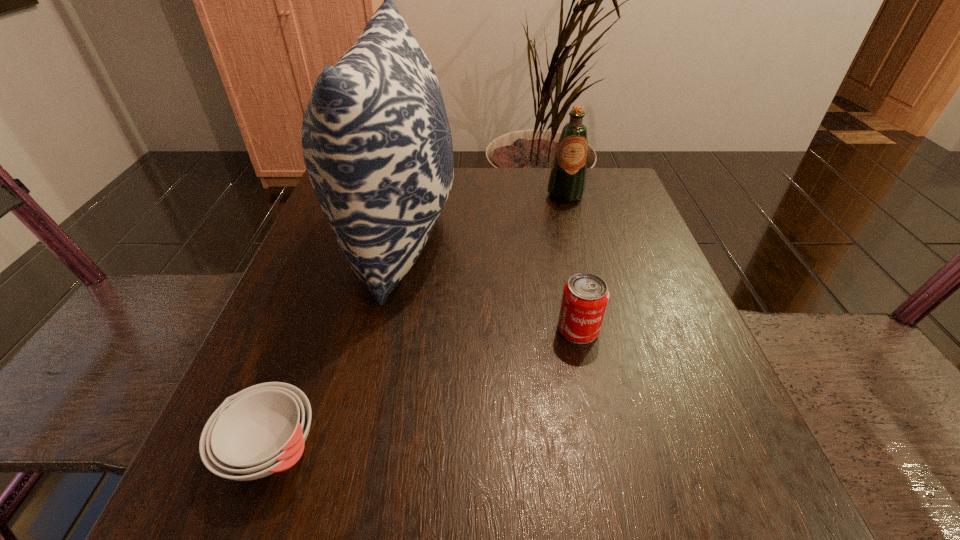
Where is `cushion`? The width and height of the screenshot is (960, 540). cushion is located at coordinates (376, 140).

In order to click on olive oil in this screenshot , I will do `click(567, 181)`.

The height and width of the screenshot is (540, 960). Find the location of `the second shortest object`. the second shortest object is located at coordinates (585, 296).

I want to click on soup bowl, so click(260, 430).

The image size is (960, 540). What are the coordinates of `the nearest object` in the screenshot? It's located at (260, 430).

Image resolution: width=960 pixels, height=540 pixels. Identify the location of vacant space located on the front surface of the cushion. (479, 235).

Locate an element on the screen. vacant space positioned on the front-facing side of the olive oil is located at coordinates (580, 250).

What are the coordinates of `free space located 0.370m on the back of the third tallest object` in the screenshot? It's located at (550, 201).

The width and height of the screenshot is (960, 540). In order to click on free location located 0.170m on the right of the shortest object in this screenshot , I will do `click(446, 448)`.

This screenshot has height=540, width=960. In order to click on cushion located at the far edge in this screenshot , I will do `click(376, 140)`.